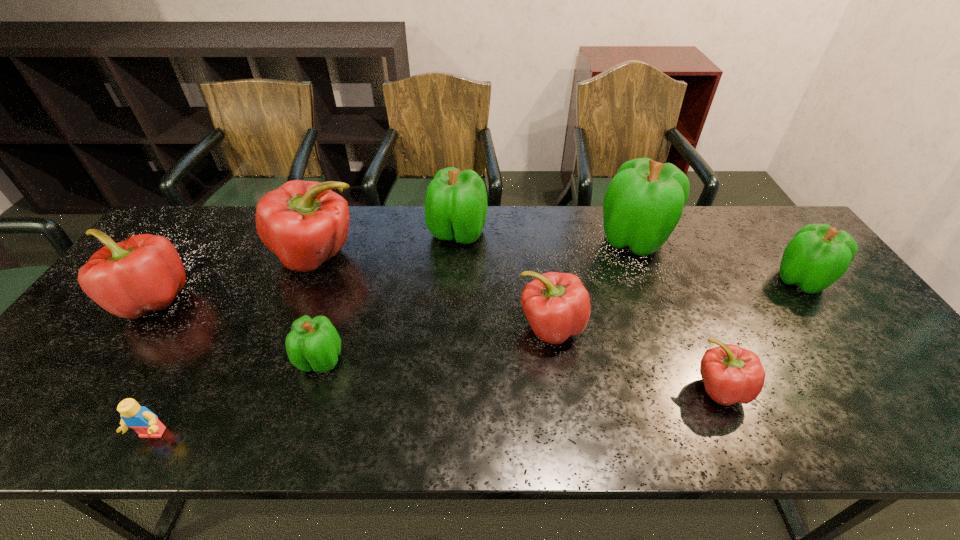
Identify the location of empty space that is in between the smallest green bell pepper and the third pink bell pepper from right to left. (319, 308).

Identify which object is located as the fourth nearest to the leftmost object. Please provide its 2D coordinates. Your answer should be formatted as a tuple, i.e. [(x, y)], where the tuple contains the x and y coordinates of a point satisfying the conditions above.

[(456, 204)]

Locate which object is the second closest to the second pink bell pepper from right to left. Please provide its 2D coordinates. Your answer should be formatted as a tuple, i.e. [(x, y)], where the tuple contains the x and y coordinates of a point satisfying the conditions above.

[(456, 204)]

Where is `bell pepper that stands as the sixth closest to the nearest object`? Image resolution: width=960 pixels, height=540 pixels. bell pepper that stands as the sixth closest to the nearest object is located at coordinates (643, 203).

Identify which bell pepper is the sixth nearest to the smallest green bell pepper. Please provide its 2D coordinates. Your answer should be formatted as a tuple, i.e. [(x, y)], where the tuple contains the x and y coordinates of a point satisfying the conditions above.

[(731, 374)]

Point out which green bell pepper is positioned as the nearest to the rightmost object. Please provide its 2D coordinates. Your answer should be formatted as a tuple, i.e. [(x, y)], where the tuple contains the x and y coordinates of a point satisfying the conditions above.

[(643, 203)]

Select which green bell pepper is the second closest to the fourth bell pepper from right to left. Please provide its 2D coordinates. Your answer should be formatted as a tuple, i.e. [(x, y)], where the tuple contains the x and y coordinates of a point satisfying the conditions above.

[(456, 204)]

Identify which pink bell pepper is the fourth closest to the rightmost bell pepper. Please provide its 2D coordinates. Your answer should be formatted as a tuple, i.e. [(x, y)], where the tuple contains the x and y coordinates of a point satisfying the conditions above.

[(143, 273)]

Identify the location of the second closest pink bell pepper relative to the biggest green bell pepper. (731, 374).

Where is `blank space that satisfies the following two spatial constraints: 1. on the front side of the third biggest pink bell pepper; 2. on the right side of the rightmost pink bell pepper`? The width and height of the screenshot is (960, 540). blank space that satisfies the following two spatial constraints: 1. on the front side of the third biggest pink bell pepper; 2. on the right side of the rightmost pink bell pepper is located at coordinates (560, 388).